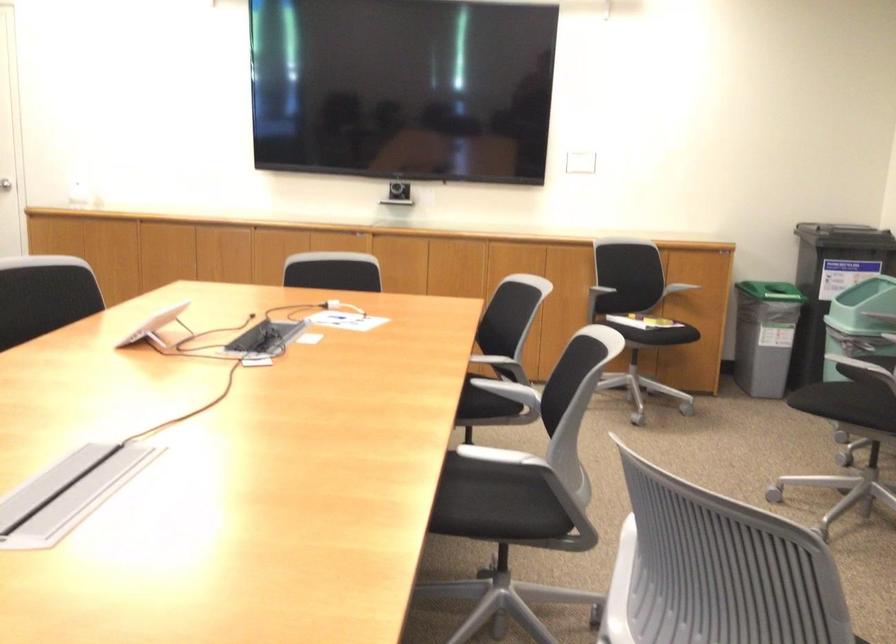
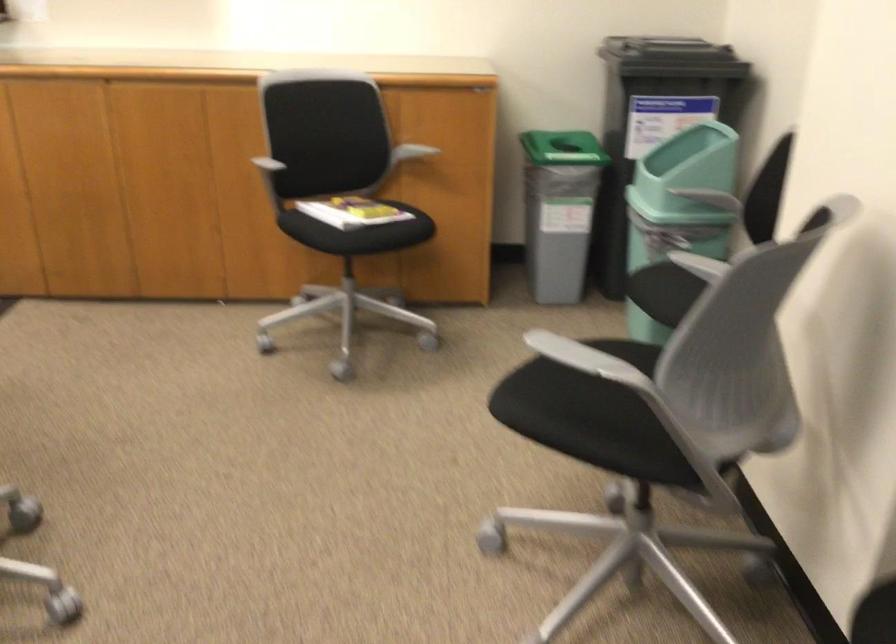
Question: I am providing you with two images of the same scene from different viewpoints. Which of the following objects are not visible in image2?

Choices:
 (A) white game controller
 (B) black chair sitting surface
 (C) grey chair armrest
 (D) teal bin flap

Answer: (B)